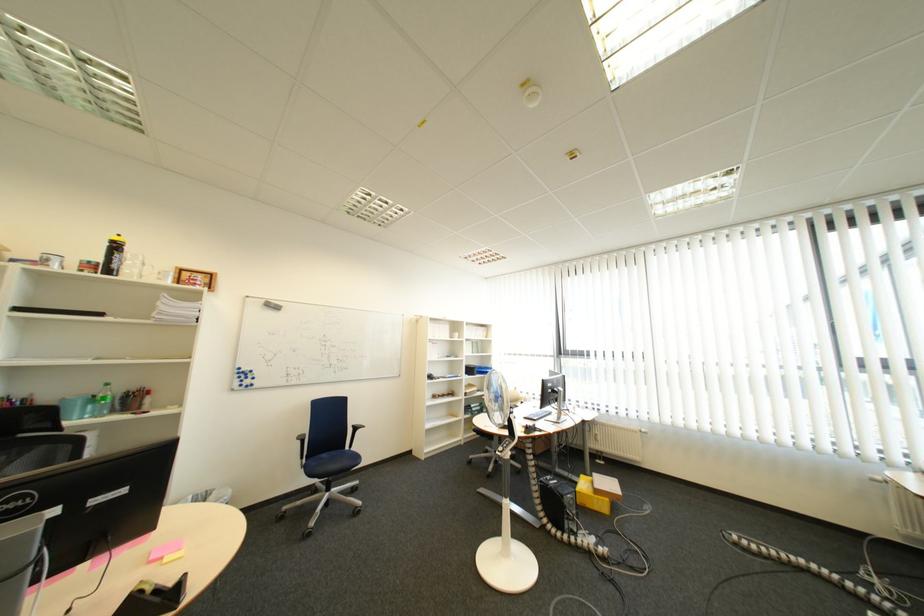
The location [598,492] corresponds to which object?

It corresponds to the yellow cardboard box in the image.